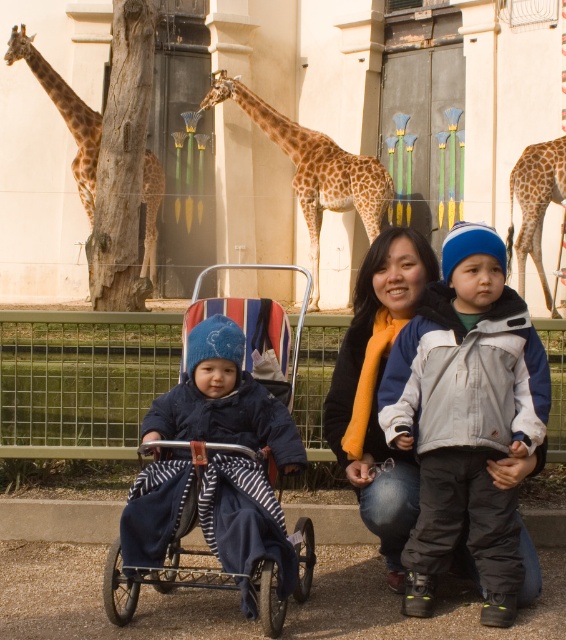
Is gray fleece jacket at center to the right of spotted fur giraffe at center from the viewer's perspective?

Correct, you'll find gray fleece jacket at center to the right of spotted fur giraffe at center.

In the scene shown: Who is lower down, gray fleece jacket at center or spotted fur giraffe at center?

gray fleece jacket at center is below.

Who is more forward, (414, 600) or (363, 172)?

Point (414, 600) is more forward.

Locate an element on the screen. Image resolution: width=566 pixels, height=640 pixels. gray fleece jacket at center is located at coordinates tap(465, 419).

Who is positioned more to the left, dark blue fabric baby carriage at left or spotted fur giraffe at left?

spotted fur giraffe at left

Consider the image. Between dark blue fabric baby carriage at left and spotted fur giraffe at left, which one has more height?

Standing taller between the two is spotted fur giraffe at left.

At what (x,y) coordinates should I click in order to perform the action: click on dark blue fabric baby carriage at left. Please return your answer as a coordinate pair (x, y). The height and width of the screenshot is (640, 566). Looking at the image, I should click on (215, 481).

Find the location of `dark blue fabric baby carriage at left`. dark blue fabric baby carriage at left is located at coordinates (215, 481).

Locate an element on the screen. The height and width of the screenshot is (640, 566). gray fleece jacket at center is located at coordinates (465, 419).

Can you confirm if gray fleece jacket at center is positioned below dark blue fabric baby carriage at left?

No.

Image resolution: width=566 pixels, height=640 pixels. I want to click on gray fleece jacket at center, so click(465, 419).